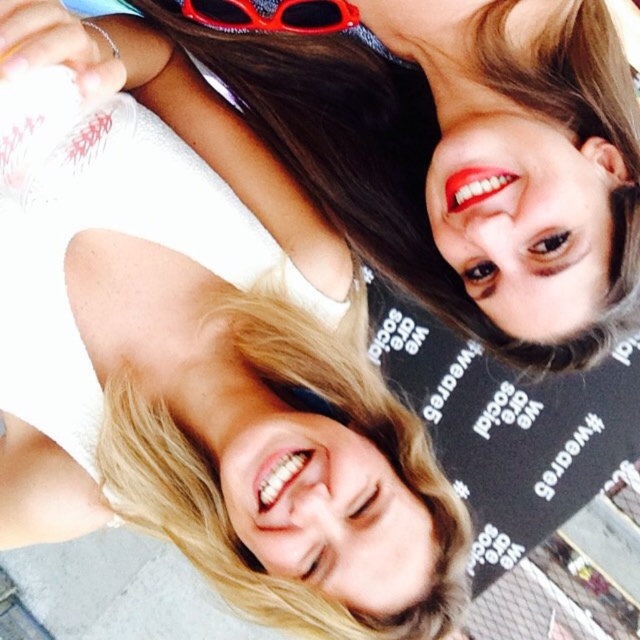
In the image, there is a point marked at coordinates (x=198, y=348). Which object from the scene is exactly at this point?

The smooth skin face at upper right is located at point (x=198, y=348).

Based on the scene description, which object is wider between the smooth skin face at upper right and the red plastic goggles at upper center?

The smooth skin face at upper right is wider than the red plastic goggles at upper center according to the description.

What are the coordinates of the smooth skin face at upper right in the image?

The smooth skin face at upper right is located at coordinates point (198, 348).